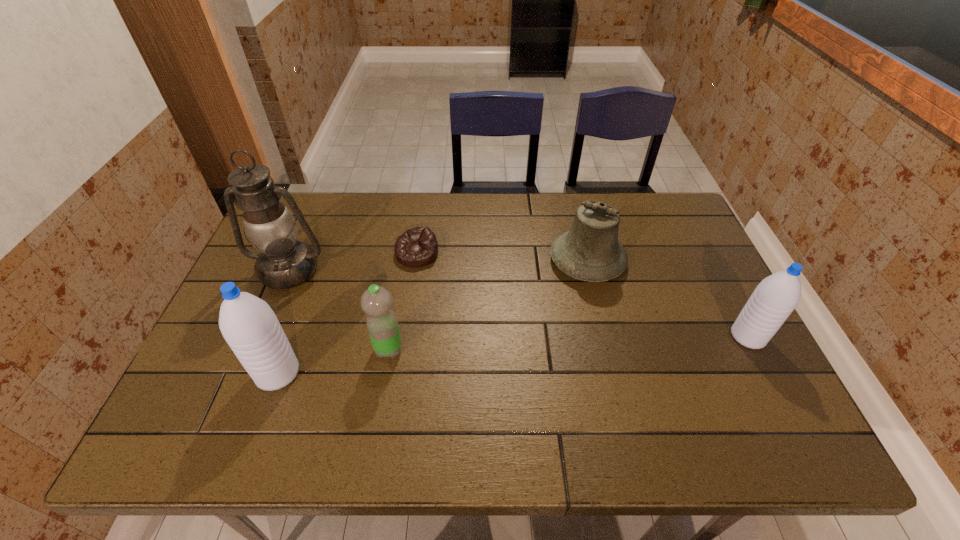
The height and width of the screenshot is (540, 960). Identify the location of free space at the near edge. (355, 375).

I want to click on free location at the left edge, so click(275, 302).

This screenshot has height=540, width=960. I want to click on vacant space at the right edge of the desktop, so click(x=721, y=347).

This screenshot has width=960, height=540. What are the coordinates of `free space at the far left corner` in the screenshot? It's located at (323, 212).

Where is `blank region between the beanbag and the rightmost water bottle`? Image resolution: width=960 pixels, height=540 pixels. blank region between the beanbag and the rightmost water bottle is located at coordinates (583, 295).

The image size is (960, 540). In order to click on free space between the rightmost water bottle and the second water bottle from right to left in this screenshot , I will do `click(568, 343)`.

Find the location of a particular element. free spot between the beanbag and the bell is located at coordinates (502, 258).

The image size is (960, 540). I want to click on empty space that is in between the tallest water bottle and the second water bottle from right to left, so click(333, 361).

This screenshot has height=540, width=960. In order to click on empty space that is in between the rightmost water bottle and the second water bottle from right to left in this screenshot , I will do `click(568, 343)`.

You are a GUI agent. You are given a task and a screenshot of the screen. Output one action in this format:
    pyautogui.click(x=<x>, y=<y>)
    Task: Click on the vacant space that is in between the rightmost object and the bell
    Image resolution: width=960 pixels, height=540 pixels.
    Given the screenshot: What is the action you would take?
    pyautogui.click(x=667, y=299)